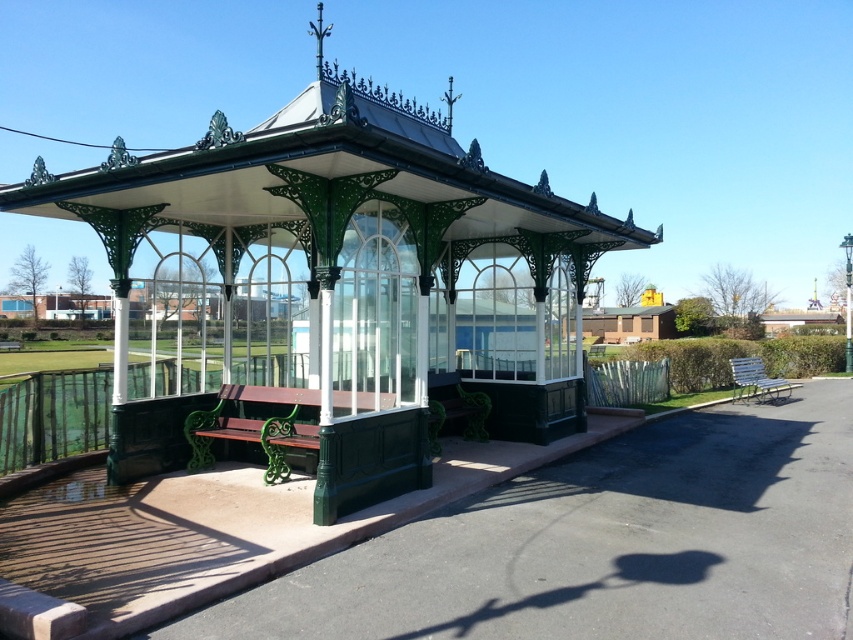
Question: Which object is farther from the camera taking this photo?

Choices:
 (A) green wrought iron gazebo at center
 (B) metallic silver bench at right
 (C) wooden bench at center

Answer: (B)

Question: Can you confirm if wooden bench at center is positioned to the left of metallic silver bench at right?

Choices:
 (A) no
 (B) yes

Answer: (B)

Question: Which object is closer to the camera taking this photo?

Choices:
 (A) metallic silver bench at right
 (B) green wrought iron gazebo at center

Answer: (B)

Question: Is green wrought iron gazebo at center smaller than metallic silver bench at right?

Choices:
 (A) yes
 (B) no

Answer: (B)

Question: Based on their relative distances, which object is farther from the metallic silver bench at right?

Choices:
 (A) green wrought iron gazebo at center
 (B) wooden bench at center

Answer: (B)

Question: Can you confirm if green wrought iron gazebo at center is smaller than metallic silver bench at right?

Choices:
 (A) no
 (B) yes

Answer: (A)